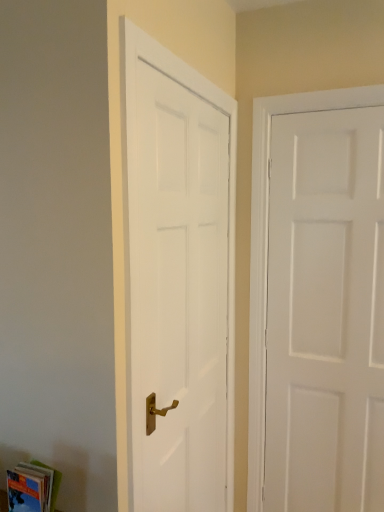
You are a GUI agent. You are given a task and a screenshot of the screen. Output one action in this format:
    pyautogui.click(x=<x>, y=<y>)
    Task: Click on the white matte door at right, the 2th door viewed from the left
    The height and width of the screenshot is (512, 384).
    Given the screenshot: What is the action you would take?
    pyautogui.click(x=325, y=312)

The image size is (384, 512). I want to click on hardcover book at lower left, so click(x=30, y=488).

Measure the distance between white smooth door at left, which is counted as the second door, starting from the right, and camera.

white smooth door at left, which is counted as the second door, starting from the right, is 3.54 feet from camera.

I want to click on white matte door at right, the 1th door in the right-to-left sequence, so click(x=325, y=312).

Which is in front, point (220, 303) or point (58, 479)?

Point (58, 479)

Which object is thinner, white smooth door at left, placed as the 1th door when sorted from left to right, or hardcover book at lower left?

With smaller width is hardcover book at lower left.

Is white smooth door at left, placed as the 1th door when sorted from left to right, in front of or behind hardcover book at lower left in the image?

white smooth door at left, placed as the 1th door when sorted from left to right, is behind hardcover book at lower left.

Is white smooth door at left, placed as the 1th door when sorted from left to right, looking in the opposite direction of hardcover book at lower left?

No, white smooth door at left, placed as the 1th door when sorted from left to right,'s orientation is not away from hardcover book at lower left.

Is hardcover book at lower left far from white smooth door at left, which is counted as the second door, starting from the right?

No, there isn't a large distance between hardcover book at lower left and white smooth door at left, which is counted as the second door, starting from the right.

This screenshot has width=384, height=512. I want to click on the 1st door behind the hardcover book at lower left, so click(x=179, y=295).

From the picture: From a real-world perspective, is hardcover book at lower left located beneath white smooth door at left, placed as the 1th door when sorted from left to right?

Yes, from a real-world perspective, hardcover book at lower left is beneath white smooth door at left, placed as the 1th door when sorted from left to right.

Which of these two, white matte door at right, the 2th door viewed from the left, or white smooth door at left, placed as the 1th door when sorted from left to right, stands taller?

Standing taller between the two is white matte door at right, the 2th door viewed from the left.

Based on the photo, from a real-world perspective, which object stands above the other?

white smooth door at left, placed as the 1th door when sorted from left to right.

Does white matte door at right, the 1th door in the right-to-left sequence, come behind white smooth door at left, which is counted as the second door, starting from the right?

Yes, the depth of white matte door at right, the 1th door in the right-to-left sequence, is greater than that of white smooth door at left, which is counted as the second door, starting from the right.

Between white matte door at right, the 2th door viewed from the left, and white smooth door at left, placed as the 1th door when sorted from left to right, which one has smaller width?

white smooth door at left, placed as the 1th door when sorted from left to right, is thinner.

Does white smooth door at left, which is counted as the second door, starting from the right, have a lesser height compared to white matte door at right, the 1th door in the right-to-left sequence?

Yes.

Which is in front, white smooth door at left, which is counted as the second door, starting from the right, or white matte door at right, the 2th door viewed from the left?

white smooth door at left, which is counted as the second door, starting from the right, is more forward.

Based on the photo, from the image's perspective, which object appears higher, white smooth door at left, which is counted as the second door, starting from the right, or white matte door at right, the 2th door viewed from the left?

From the image's view, white matte door at right, the 2th door viewed from the left, is above.

Which is in front, point (222, 215) or point (328, 115)?

The point (328, 115) is closer to the camera.

Who is bigger, hardcover book at lower left or white matte door at right, the 2th door viewed from the left?

With larger size is white matte door at right, the 2th door viewed from the left.

From a real-world perspective, who is located lower, hardcover book at lower left or white matte door at right, the 2th door viewed from the left?

From a 3D spatial view, hardcover book at lower left is below.

Considering the sizes of hardcover book at lower left and white matte door at right, the 1th door in the right-to-left sequence, in the image, is hardcover book at lower left taller or shorter than white matte door at right, the 1th door in the right-to-left sequence,?

Considering their sizes, hardcover book at lower left has less height than white matte door at right, the 1th door in the right-to-left sequence.

How many degrees apart are the facing directions of hardcover book at lower left and white matte door at right, the 2th door viewed from the left?

The angle between the facing direction of hardcover book at lower left and the facing direction of white matte door at right, the 2th door viewed from the left, is 0.596 degrees.

Can you confirm if white matte door at right, the 1th door in the right-to-left sequence, is positioned to the left of hardcover book at lower left?

In fact, white matte door at right, the 1th door in the right-to-left sequence, is to the right of hardcover book at lower left.

Is point (312, 496) less distant than point (17, 486)?

No, it is behind (17, 486).

Between white matte door at right, the 2th door viewed from the left, and hardcover book at lower left, which one has larger width?

white matte door at right, the 2th door viewed from the left.

Is white matte door at right, the 1th door in the right-to-left sequence, oriented away from hardcover book at lower left?

No, hardcover book at lower left is not at the back of white matte door at right, the 1th door in the right-to-left sequence.

Starting from the hardcover book at lower left, which door is the 1st one to the right? Please provide its 2D coordinates.

[(179, 295)]

From a real-world perspective, count 2nd doors upward from the hardcover book at lower left and point to it. Please provide its 2D coordinates.

[(179, 295)]

Estimate the real-world distances between objects in this image. Which object is further from hardcover book at lower left, white matte door at right, the 2th door viewed from the left, or white smooth door at left, which is counted as the second door, starting from the right?

white matte door at right, the 2th door viewed from the left, lies further to hardcover book at lower left than the other object.

Considering their positions, is white smooth door at left, placed as the 1th door when sorted from left to right, positioned further to white matte door at right, the 2th door viewed from the left, than hardcover book at lower left?

The object further to white matte door at right, the 2th door viewed from the left, is hardcover book at lower left.

Consider the image. From the image, which object appears to be nearer to white smooth door at left, placed as the 1th door when sorted from left to right, white matte door at right, the 1th door in the right-to-left sequence, or hardcover book at lower left?

white matte door at right, the 1th door in the right-to-left sequence, is closer to white smooth door at left, placed as the 1th door when sorted from left to right.

Which object lies nearer to the anchor point hardcover book at lower left, white smooth door at left, which is counted as the second door, starting from the right, or white matte door at right, the 2th door viewed from the left?

Among the two, white smooth door at left, which is counted as the second door, starting from the right, is located nearer to hardcover book at lower left.

Which object lies nearer to the anchor point white smooth door at left, which is counted as the second door, starting from the right, hardcover book at lower left or white matte door at right, the 1th door in the right-to-left sequence?

white matte door at right, the 1th door in the right-to-left sequence.

Considering their positions, is hardcover book at lower left positioned closer to white matte door at right, the 1th door in the right-to-left sequence, than white smooth door at left, placed as the 1th door when sorted from left to right?

Based on the image, white smooth door at left, placed as the 1th door when sorted from left to right, appears to be nearer to white matte door at right, the 1th door in the right-to-left sequence.

Locate an element on the screen. This screenshot has width=384, height=512. door located between hardcover book at lower left and white matte door at right, the 1th door in the right-to-left sequence, in the left-right direction is located at coordinates [x=179, y=295].